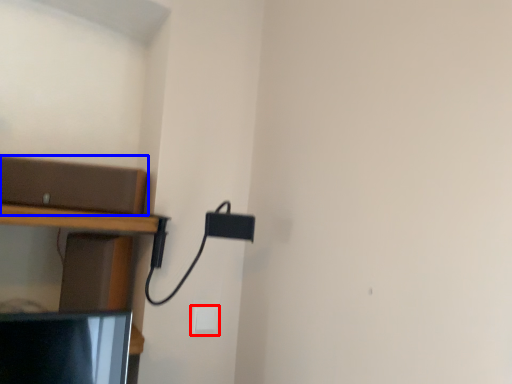
Question: Among these objects, which one is farthest to the camera, light switch (highlighted by a red box) or shelf (highlighted by a blue box)?

Choices:
 (A) light switch
 (B) shelf

Answer: (A)